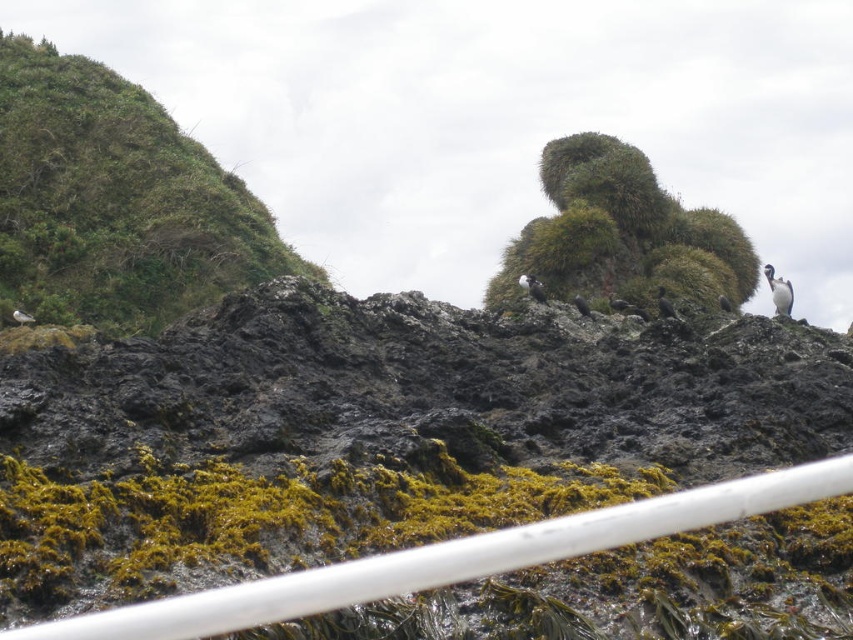
You are a hiker trying to cross the rocky shoreline. You see a white plastic rail at lower center and a green mossy rock at center. Which object is narrower in width?

The white plastic rail at lower center has a lesser width compared to the green mossy rock at center, so the white plastic rail at lower center is narrower.

You are a hiker carrying a 30 meter long rope. You want to secure the rope between the white plastic rail at lower center and the green mossy rock at center to cross a gap. Is the rope long enough?

The white plastic rail at lower center and green mossy rock at center are 27.37 meters apart, so the 30 meter long rope is long enough to secure between them.